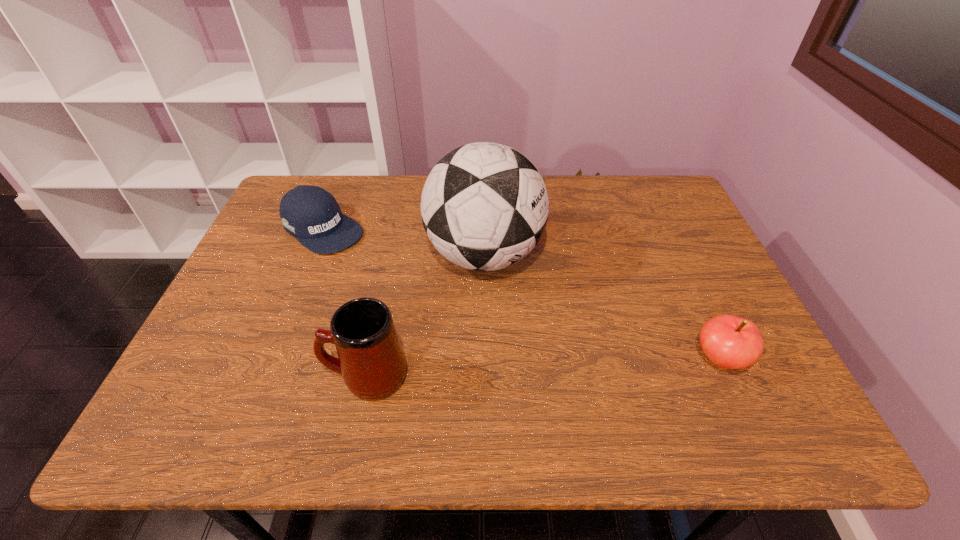
You are a GUI agent. You are given a task and a screenshot of the screen. Output one action in this format:
    pyautogui.click(x=<x>, y=<y>)
    Task: Click on the mug
    This screenshot has height=540, width=960.
    Given the screenshot: What is the action you would take?
    pos(370,358)

I want to click on the second object from left to right, so point(370,358).

The image size is (960, 540). I want to click on apple, so click(x=731, y=342).

What are the coordinates of `the tallest object` in the screenshot? It's located at (484, 206).

Identify the location of the second object from right to left. (484, 206).

Identify the location of baseball cap. This screenshot has height=540, width=960. (311, 214).

Locate an element on the screen. The height and width of the screenshot is (540, 960). the leftmost object is located at coordinates (311, 214).

Image resolution: width=960 pixels, height=540 pixels. Identify the location of vacant space situated on the side of the mug with the handle. (193, 376).

Identify the location of blank space located 0.140m on the side of the mug with the handle. The width and height of the screenshot is (960, 540). (259, 376).

In order to click on free space located 0.290m on the side of the mug with the handle in this screenshot , I will do `click(188, 376)`.